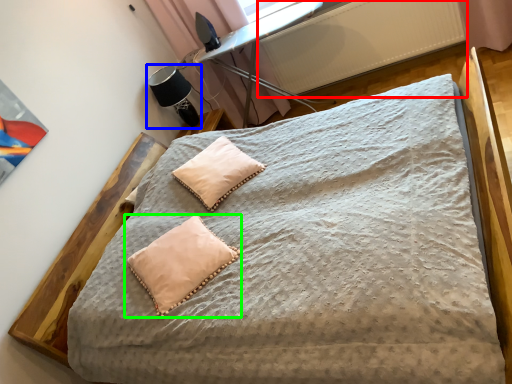
Question: Which object is positioned farthest from radiator (highlighted by a red box)? Select from table lamp (highlighted by a blue box) and pillow (highlighted by a green box).

Choices:
 (A) table lamp
 (B) pillow

Answer: (B)